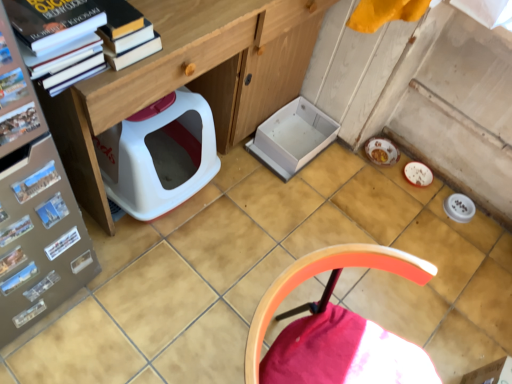
Question: Is white matte paper at left, positioned as the second paperback book in top-to-bottom order, positioned far away from metallic glossy magazine at lower left, which is the 4th magazine in back-to-front order?

Choices:
 (A) yes
 (B) no

Answer: (B)

Question: Does white matte paper at left, the first paperback book positioned from the bottom, have a lesser width compared to metallic glossy magazine at lower left, which is the 4th magazine in back-to-front order?

Choices:
 (A) yes
 (B) no

Answer: (B)

Question: Is white matte paper at left, positioned as the second paperback book in top-to-bottom order, bigger than metallic glossy magazine at lower left, which is the 4th magazine in back-to-front order?

Choices:
 (A) no
 (B) yes

Answer: (B)

Question: From the image's perspective, does white matte paper at left, positioned as the second paperback book in top-to-bottom order, appear higher than metallic glossy magazine at lower left, which is the 4th magazine in back-to-front order?

Choices:
 (A) yes
 (B) no

Answer: (A)

Question: From a real-world perspective, does white matte paper at left, placed as the second paperback book when sorted from front to back, stand above metallic glossy magazine at lower left, which is the 4th magazine in back-to-front order?

Choices:
 (A) no
 (B) yes

Answer: (A)

Question: Is matte cardboard magazine at left, which is the 1th magazine in front-to-back order, inside the boundaries of blue matte postcard at left, the 1th paperback book positioned from the front, or outside?

Choices:
 (A) outside
 (B) inside

Answer: (A)

Question: Looking at their shapes, would you say matte cardboard magazine at left, which is the 1th magazine in front-to-back order, is wider or thinner than blue matte postcard at left, the 2th paperback book positioned from the back?

Choices:
 (A) thin
 (B) wide

Answer: (A)

Question: Considering their positions, is matte cardboard magazine at left, the seventh magazine when ordered from back to front, located in front of or behind blue matte postcard at left, the 2th paperback book positioned from the back?

Choices:
 (A) front
 (B) behind

Answer: (A)

Question: Looking at the image, does matte cardboard magazine at left, the seventh magazine when ordered from back to front, seem bigger or smaller compared to blue matte postcard at left, acting as the 1th paperback book starting from the top?

Choices:
 (A) big
 (B) small

Answer: (B)

Question: Is metallic glossy magazine at lower left, the 6th magazine when ordered from front to back, inside the boundaries of white matte book at lower left, marked as the 2th book in a top-to-bottom arrangement, or outside?

Choices:
 (A) inside
 (B) outside

Answer: (B)

Question: In terms of size, does metallic glossy magazine at lower left, acting as the 2th magazine starting from the back, appear bigger or smaller than white matte book at lower left, placed as the first book when sorted from bottom to top?

Choices:
 (A) big
 (B) small

Answer: (A)

Question: In terms of height, does metallic glossy magazine at lower left, acting as the 2th magazine starting from the back, look taller or shorter compared to white matte book at lower left, marked as the first book in a back-to-front arrangement?

Choices:
 (A) short
 (B) tall

Answer: (A)

Question: Looking at their shapes, would you say metallic glossy magazine at lower left, acting as the 2th magazine starting from the back, is wider or thinner than white matte book at lower left, marked as the first book in a back-to-front arrangement?

Choices:
 (A) thin
 (B) wide

Answer: (A)

Question: Is point [303, 266] positioned closer to the camera than point [9, 253]?

Choices:
 (A) closer
 (B) farther

Answer: (A)

Question: From a real-world perspective, relative to metallic glossy magazine at lower left, which is the 4th magazine in back-to-front order, is wooden chair at lower right vertically above or below?

Choices:
 (A) above
 (B) below

Answer: (B)